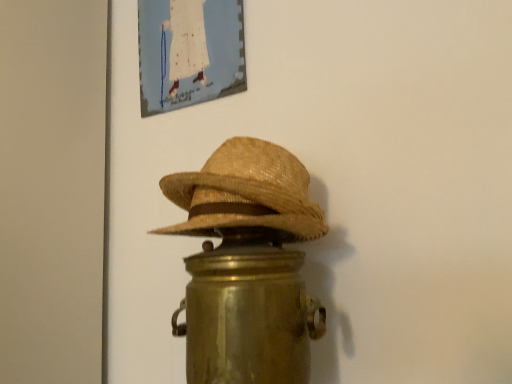
Question: From the image's perspective, does matte canvas painting at upper center appear higher than woven straw cowboy hat at center?

Choices:
 (A) no
 (B) yes

Answer: (B)

Question: From a real-world perspective, is matte canvas painting at upper center physically above woven straw cowboy hat at center?

Choices:
 (A) no
 (B) yes

Answer: (B)

Question: Could woven straw cowboy hat at center be considered to be inside matte canvas painting at upper center?

Choices:
 (A) no
 (B) yes

Answer: (A)

Question: Considering the relative sizes of matte canvas painting at upper center and woven straw cowboy hat at center in the image provided, is matte canvas painting at upper center thinner than woven straw cowboy hat at center?

Choices:
 (A) yes
 (B) no

Answer: (A)

Question: Are matte canvas painting at upper center and woven straw cowboy hat at center making contact?

Choices:
 (A) yes
 (B) no

Answer: (B)

Question: Considering the relative positions of matte canvas painting at upper center and woven straw cowboy hat at center in the image provided, is matte canvas painting at upper center to the right of woven straw cowboy hat at center from the viewer's perspective?

Choices:
 (A) yes
 (B) no

Answer: (B)

Question: Is woven straw cowboy hat at center located outside matte canvas painting at upper center?

Choices:
 (A) no
 (B) yes

Answer: (B)

Question: Is woven straw cowboy hat at center facing towards matte canvas painting at upper center?

Choices:
 (A) yes
 (B) no

Answer: (B)

Question: Does woven straw cowboy hat at center have a lesser width compared to matte canvas painting at upper center?

Choices:
 (A) yes
 (B) no

Answer: (B)

Question: From the image's perspective, would you say woven straw cowboy hat at center is positioned over matte canvas painting at upper center?

Choices:
 (A) yes
 (B) no

Answer: (B)

Question: Does woven straw cowboy hat at center have a greater height compared to matte canvas painting at upper center?

Choices:
 (A) yes
 (B) no

Answer: (B)

Question: Can matte canvas painting at upper center be found inside woven straw cowboy hat at center?

Choices:
 (A) yes
 (B) no

Answer: (B)

Question: Is matte canvas painting at upper center bigger or smaller than woven straw cowboy hat at center?

Choices:
 (A) small
 (B) big

Answer: (A)